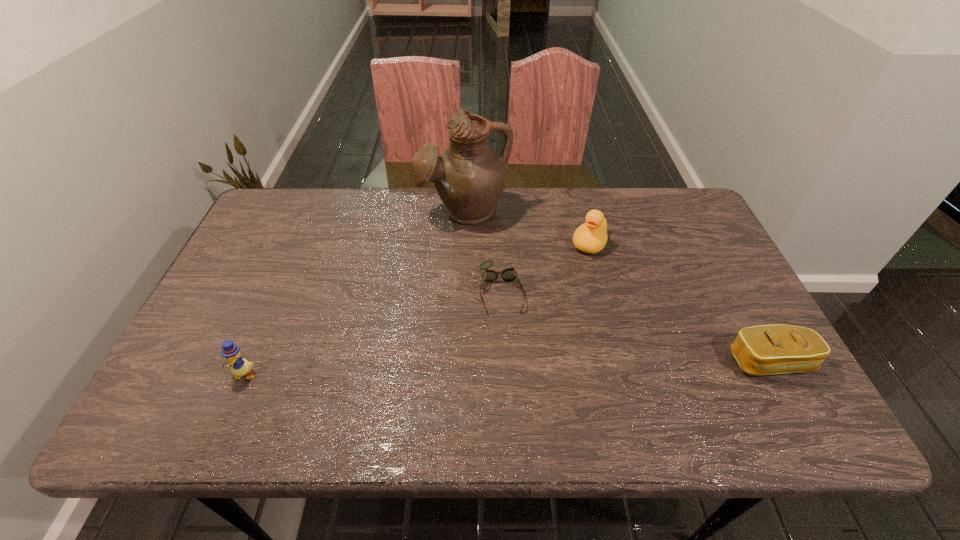
Find the location of a particular element. the leftmost object is located at coordinates (240, 367).

This screenshot has width=960, height=540. I want to click on the rightmost object, so click(767, 349).

Find the location of a particular element. The height and width of the screenshot is (540, 960). clutch bag is located at coordinates (767, 349).

Identify the location of the tallest object. (469, 177).

Find the location of `the fourth object from left to right`. the fourth object from left to right is located at coordinates (591, 237).

The height and width of the screenshot is (540, 960). Find the location of `spectacles`. spectacles is located at coordinates (508, 274).

What are the coordinates of `the shortest object` in the screenshot? It's located at (508, 274).

The image size is (960, 540). Find the location of `free spot located 0.390m at the spout of the pitcher`. free spot located 0.390m at the spout of the pitcher is located at coordinates (469, 339).

Locate an element on the screen. vacant region located at the spout of the pitcher is located at coordinates (468, 328).

Locate an element on the screen. Image resolution: width=960 pixels, height=540 pixels. free space located 0.340m at the spout of the pitcher is located at coordinates (468, 322).